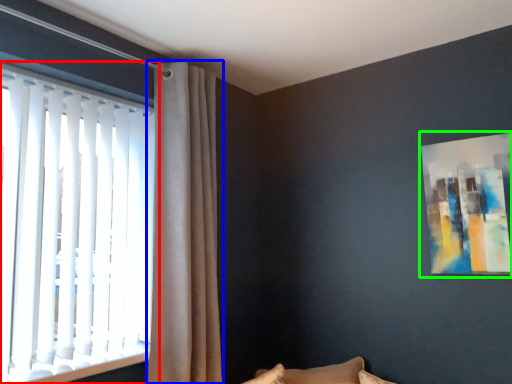
Question: Which object is positioned closest to window (highlighted by a red box)? Select from curtain (highlighted by a blue box) and picture frame (highlighted by a green box).

Choices:
 (A) curtain
 (B) picture frame

Answer: (A)